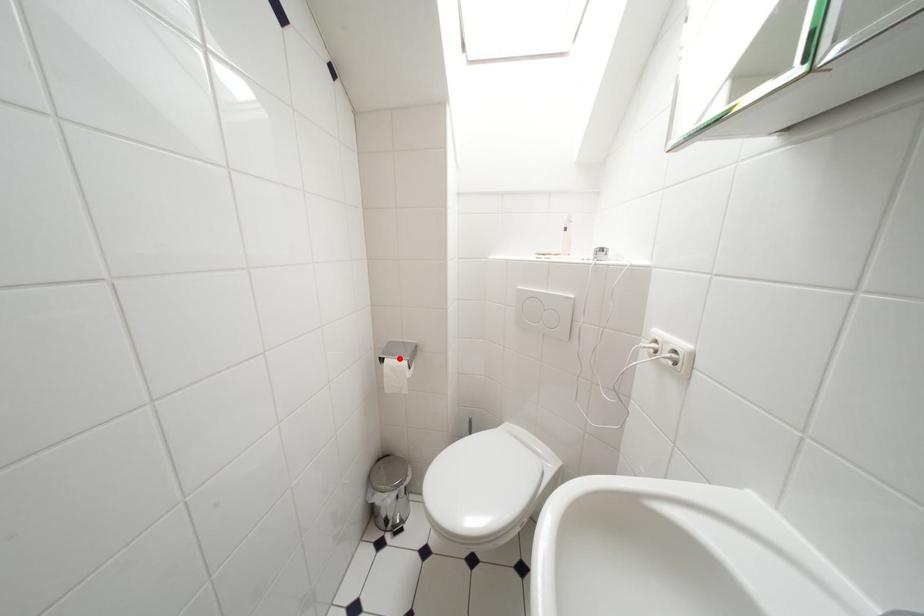
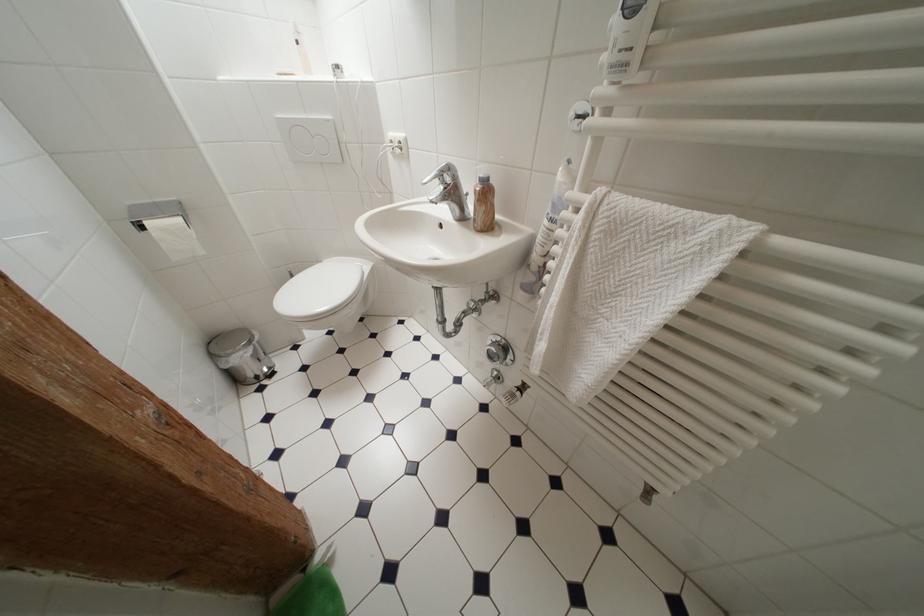
Locate, in the second image, the point that corresponds to the highlighted location in the first image.

(160, 219)